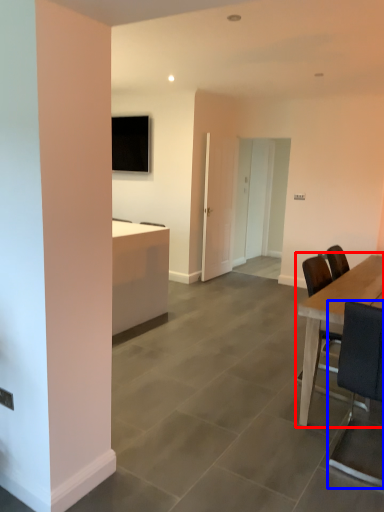
Question: Which of the following is the closest to the observer, table (highlighted by a red box) or chair (highlighted by a blue box)?

Choices:
 (A) table
 (B) chair

Answer: (B)